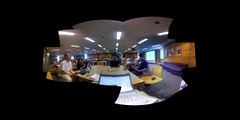
Identify the location of keyboard. pyautogui.click(x=128, y=96).